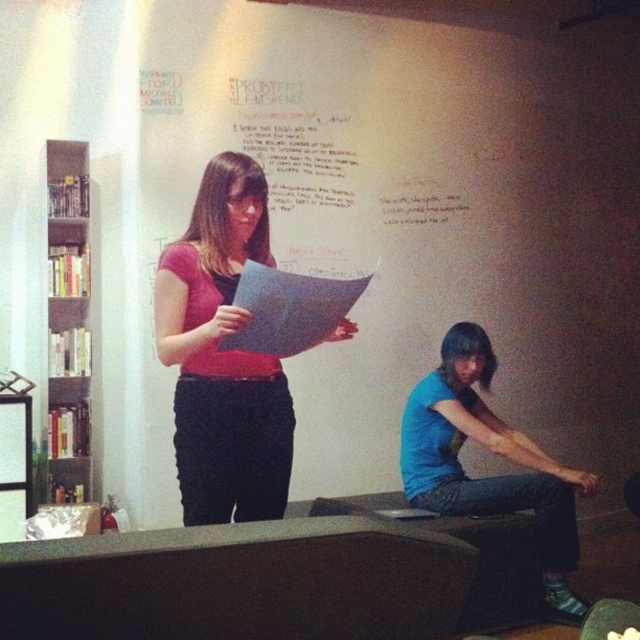
You are standing in the room and want to walk from point A to point B. Point A is at coordinates point (330, 212) and point B is at coordinates point (243, 422). According to the scene description, which point is closer to you?

Point (243, 422) is closer to you because it is in front of point (330, 212) according to the objects description.

You are standing in the room and want to hand a document to the person wearing the blue cotton shirt at lower right. The gray mesh bookshelf at left is blocking your path. Can you move around the bookshelf to reach them?

The blue cotton shirt at lower right is to the right of the gray mesh bookshelf at left, so you can move around the left side of the gray mesh bookshelf at left to reach the blue cotton shirt at lower right.